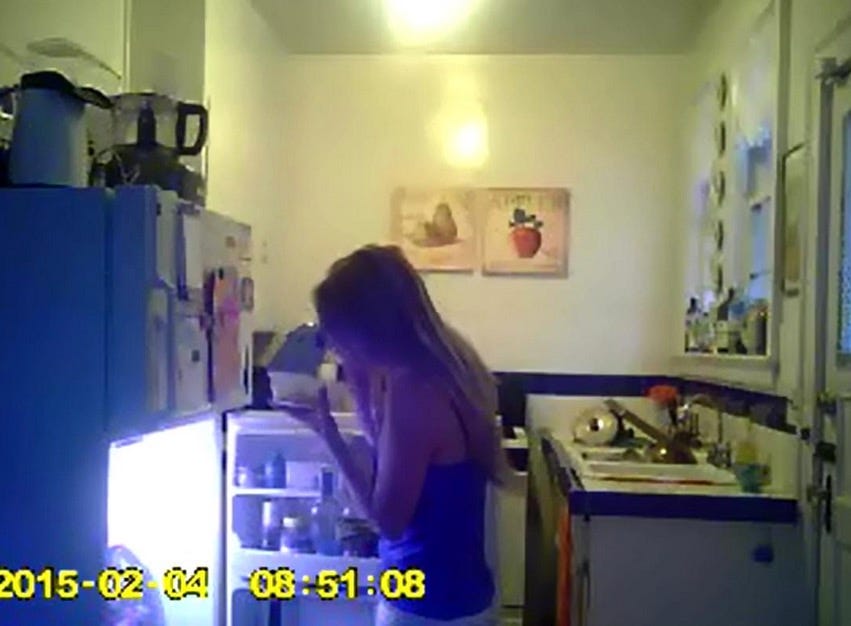
Identify the location of decorative wall hangings. This screenshot has width=851, height=626. (549, 235), (453, 242).